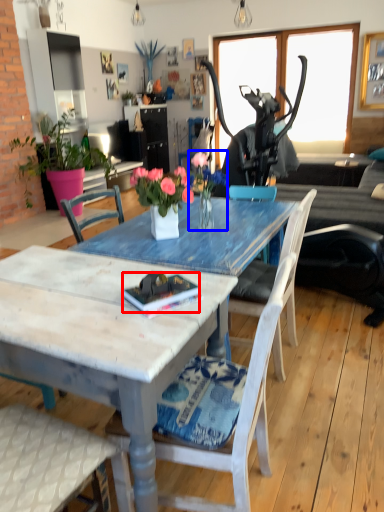
Question: Among these objects, which one is nearest to the camera, book (highlighted by a red box) or floral arrangement (highlighted by a blue box)?

Choices:
 (A) book
 (B) floral arrangement

Answer: (A)